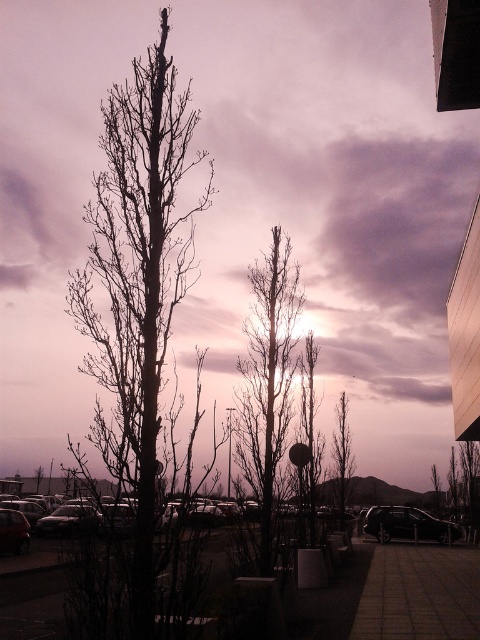
Who is more forward, (241,467) or (54,529)?

Point (241,467) is more forward.

What are the coordinates of `brown/dry wood tree at center` in the screenshot? It's located at (267, 380).

Locate an element on the screen. brown/dry wood tree at center is located at coordinates pyautogui.click(x=267, y=380).

Does gray concrete pavement at lower right have a lesser height compared to bare branches at center?

In fact, gray concrete pavement at lower right may be taller than bare branches at center.

Is gray concrete pavement at lower right positioned at the back of bare branches at center?

No, it is not.

Which is in front, point (420, 624) or point (309, 516)?

Point (420, 624) is in front.

Identify the location of gray concrete pavement at lower right. (420, 593).

Can you confirm if dark brown bark tree at center is thinner than metallic silver car at center?

Yes.

Where is `dark brown bark tree at center`? This screenshot has height=640, width=480. dark brown bark tree at center is located at coordinates (342, 454).